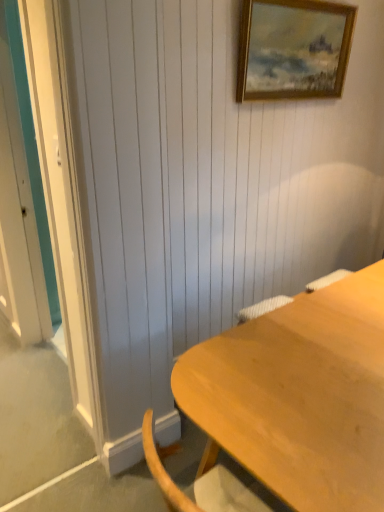
Question: Is light wood desk at lower right in front of or behind gold-framed painting at upper center in the image?

Choices:
 (A) front
 (B) behind

Answer: (A)

Question: Is light wood desk at lower right to the left or to the right of gold-framed painting at upper center in the image?

Choices:
 (A) right
 (B) left

Answer: (B)

Question: From a real-world perspective, is light wood desk at lower right positioned above or below gold-framed painting at upper center?

Choices:
 (A) below
 (B) above

Answer: (A)

Question: From the image's perspective, is gold-framed painting at upper center above or below light wood desk at lower right?

Choices:
 (A) above
 (B) below

Answer: (A)

Question: Is point (334, 52) positioned closer to the camera than point (200, 417)?

Choices:
 (A) closer
 (B) farther

Answer: (B)

Question: Considering the positions of gold-framed painting at upper center and light wood desk at lower right in the image, is gold-framed painting at upper center wider or thinner than light wood desk at lower right?

Choices:
 (A) thin
 (B) wide

Answer: (A)

Question: Relative to light wood desk at lower right, is gold-framed painting at upper center in front or behind?

Choices:
 (A) behind
 (B) front

Answer: (A)